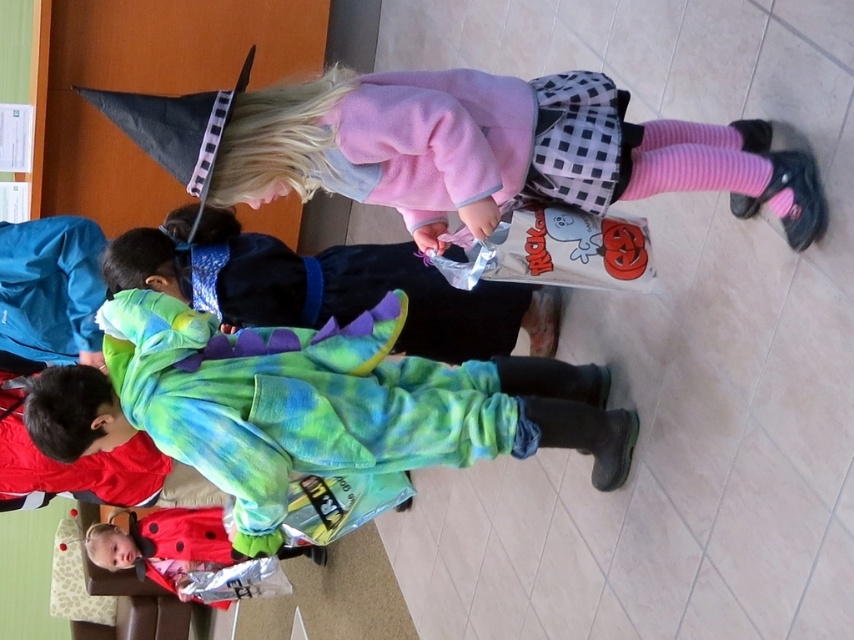
Which of these two, fluffy green costume at center or pink fleece sweater at upper center, stands shorter?

Standing shorter between the two is pink fleece sweater at upper center.

Locate an element on the screen. The height and width of the screenshot is (640, 854). fluffy green costume at center is located at coordinates (313, 404).

Locate an element on the screen. The width and height of the screenshot is (854, 640). fluffy green costume at center is located at coordinates (313, 404).